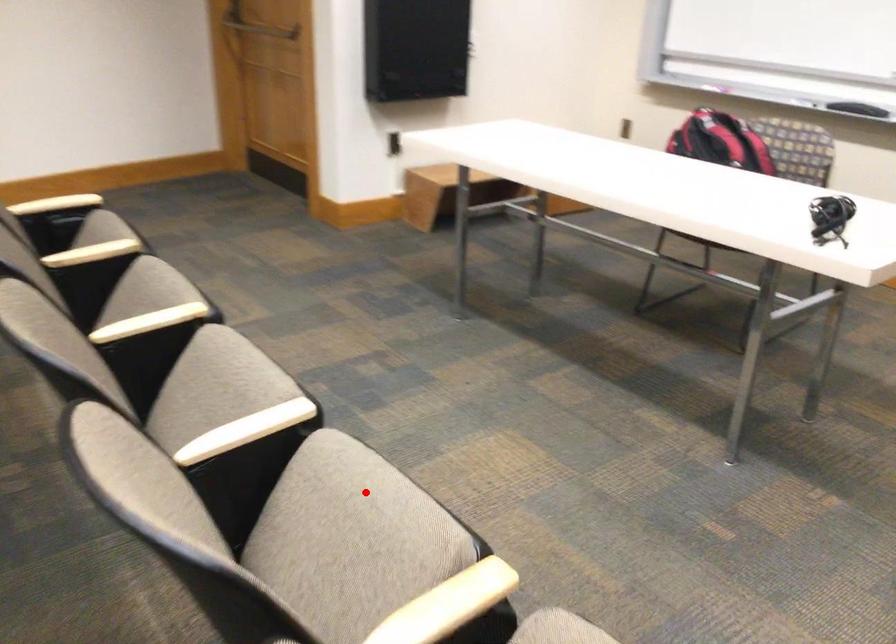
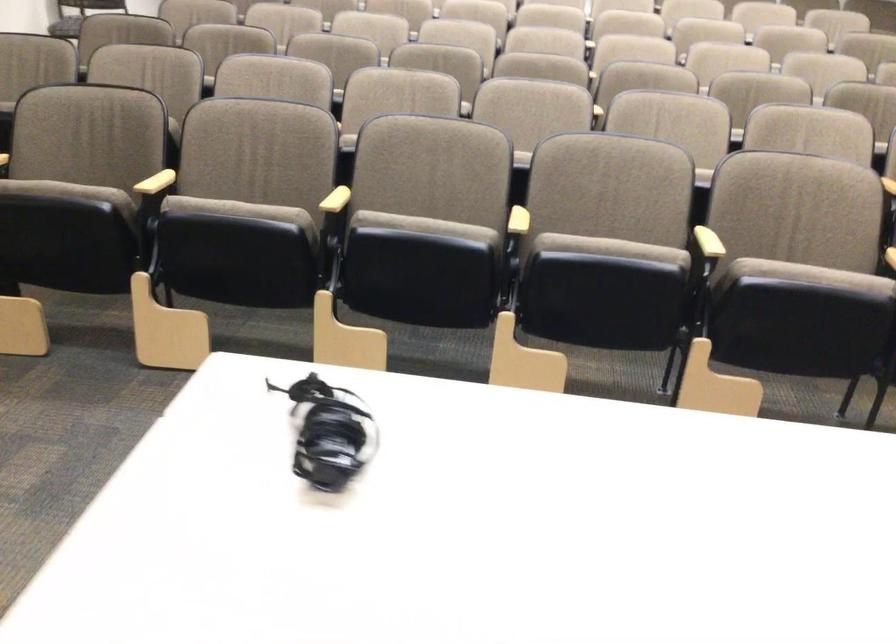
Question: I am providing you with two images of the same scene from different viewpoints. A red point is marked on the first image. Can you still see the location of the red point in image 2?

Choices:
 (A) Yes
 (B) No

Answer: (A)